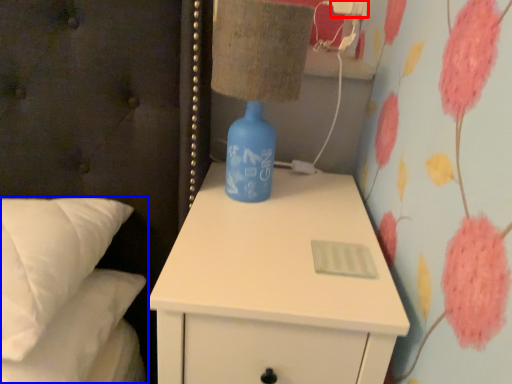
Question: Which of the following is the closest to the observer, electric outlet (highlighted by a red box) or bed (highlighted by a blue box)?

Choices:
 (A) electric outlet
 (B) bed

Answer: (B)